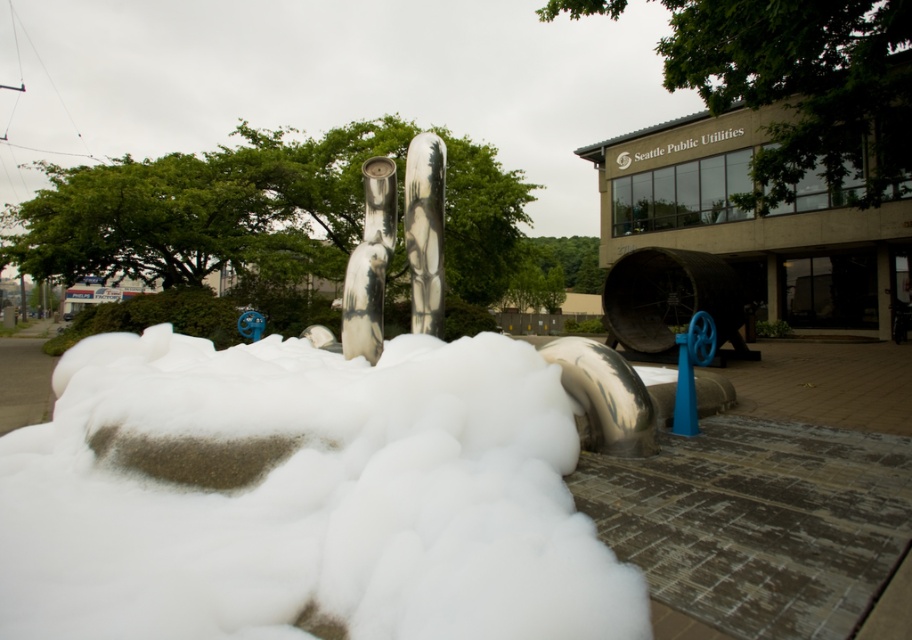
Question: Does white fluffy foam at center have a lesser width compared to brushed metal sculpture at center?

Choices:
 (A) yes
 (B) no

Answer: (B)

Question: Is shiny metallic pipe at center behind brushed metal sculpture at center?

Choices:
 (A) yes
 (B) no

Answer: (B)

Question: Which object is closer to the camera taking this photo?

Choices:
 (A) shiny metallic pipe at center
 (B) white fluffy foam at center

Answer: (B)

Question: Which point is farther from the camera taking this photo?

Choices:
 (A) (380, 228)
 (B) (413, 253)

Answer: (A)

Question: Can you confirm if shiny metallic pipe at center is positioned to the left of brushed metal sculpture at center?

Choices:
 (A) no
 (B) yes

Answer: (B)

Question: Among these objects, which one is farthest from the camera?

Choices:
 (A) white fluffy foam at center
 (B) brushed metal sculpture at center

Answer: (B)